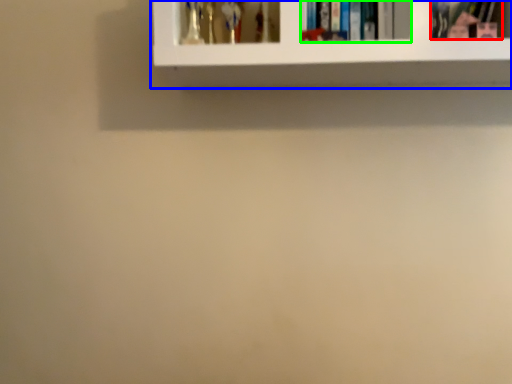
Question: Considering the real-world distances, which object is closest to book (highlighted by a red box)? shelf (highlighted by a blue box) or book (highlighted by a green box).

Choices:
 (A) shelf
 (B) book

Answer: (B)